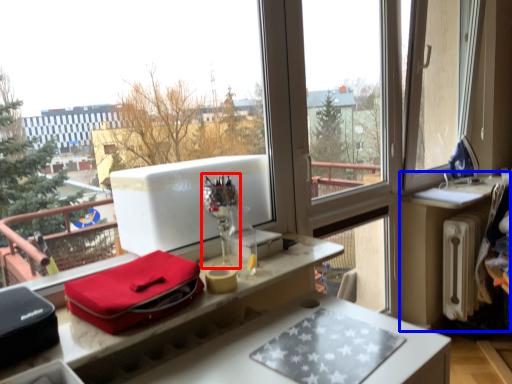
Question: Which object is closer to the camera taking this photo, wine glass (highlighted by a red box) or table (highlighted by a blue box)?

Choices:
 (A) wine glass
 (B) table

Answer: (A)